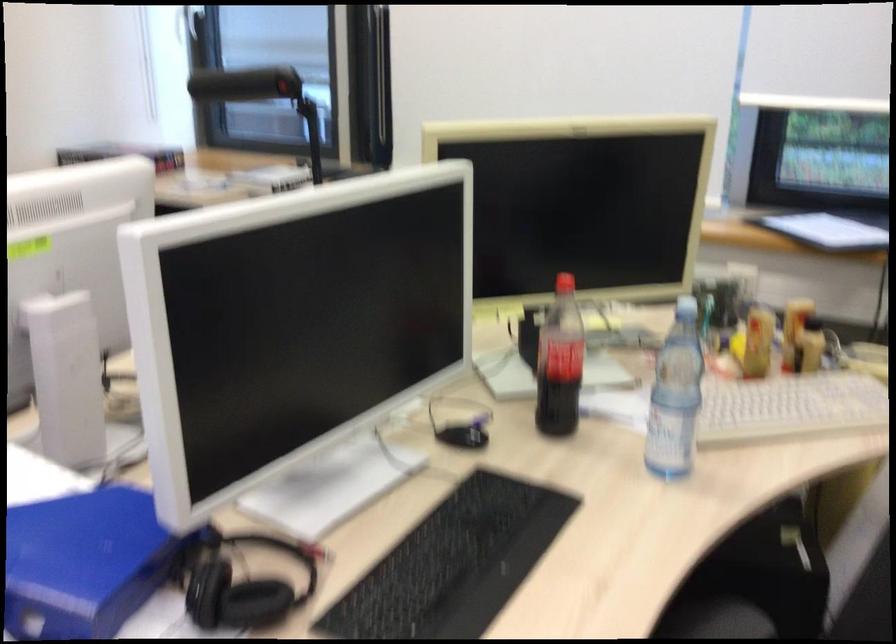
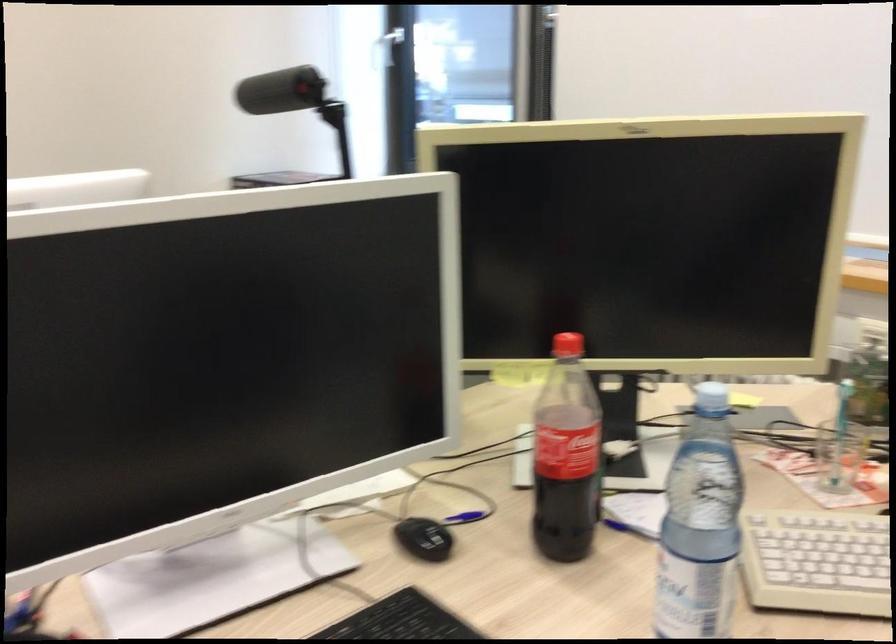
Find the pixel in the second image that matches (563,363) in the first image.

(565, 456)